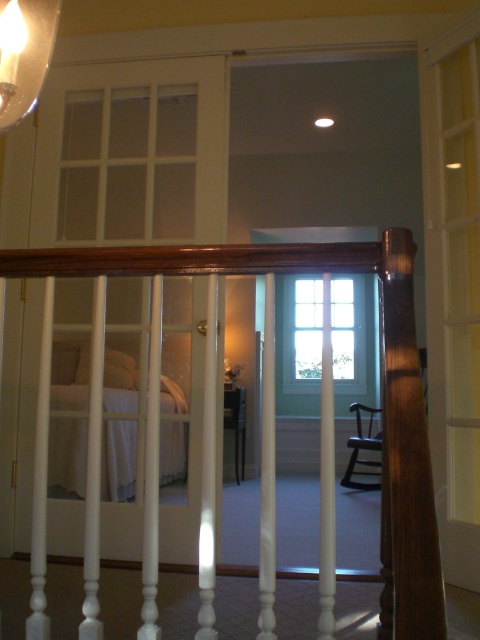
Question: From the image, what is the correct spatial relationship of wooden handrail at center in relation to matte glass lampshade at upper left?

Choices:
 (A) above
 (B) below

Answer: (B)

Question: Does wooden handrail at center lie behind matte glass lampshade at upper left?

Choices:
 (A) no
 (B) yes

Answer: (A)

Question: Which point is farther to the camera?

Choices:
 (A) matte glass lampshade at upper left
 (B) wooden handrail at center

Answer: (A)

Question: Which point is farther to the camera?

Choices:
 (A) matte glass lampshade at upper left
 (B) wooden handrail at center

Answer: (A)

Question: Is the position of wooden handrail at center more distant than that of matte glass lampshade at upper left?

Choices:
 (A) no
 (B) yes

Answer: (A)